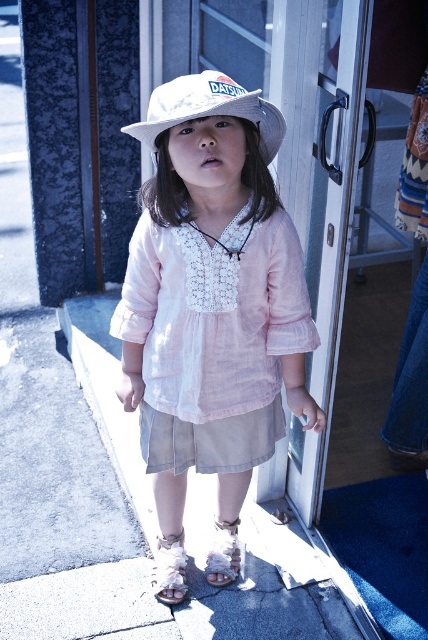
Question: Considering the real-world distances, which object is closest to the matte white hat at center?

Choices:
 (A) white straw hat at center
 (B) white fuzzy sandal at lower center

Answer: (A)

Question: In this image, where is matte white hat at center located relative to white straw hat at center?

Choices:
 (A) right
 (B) left

Answer: (A)

Question: Which object appears closest to the camera in this image?

Choices:
 (A) white straw hat at center
 (B) white fuzzy sandal at lower center
 (C) white fabric sandal at lower center

Answer: (A)

Question: Can you confirm if white straw hat at center is bigger than white fuzzy sandal at lower center?

Choices:
 (A) no
 (B) yes

Answer: (B)

Question: Which is farther from the white fuzzy sandal at lower center?

Choices:
 (A) white fabric sandal at lower center
 (B) matte white hat at center

Answer: (B)

Question: Considering the relative positions of white straw hat at center and white fuzzy sandal at lower center in the image provided, where is white straw hat at center located with respect to white fuzzy sandal at lower center?

Choices:
 (A) above
 (B) below

Answer: (A)